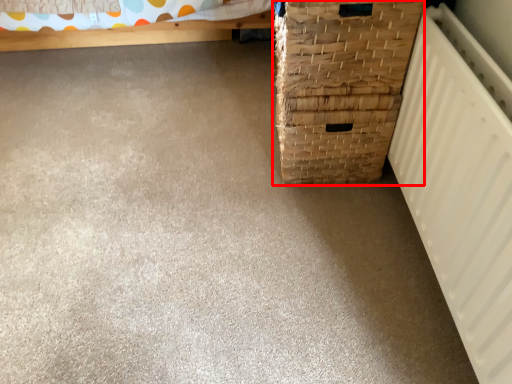
Question: From the image's perspective, considering the relative positions of basket container (annotated by the red box) and radiator in the image provided, where is basket container (annotated by the red box) located with respect to the staircase?

Choices:
 (A) above
 (B) below

Answer: (A)